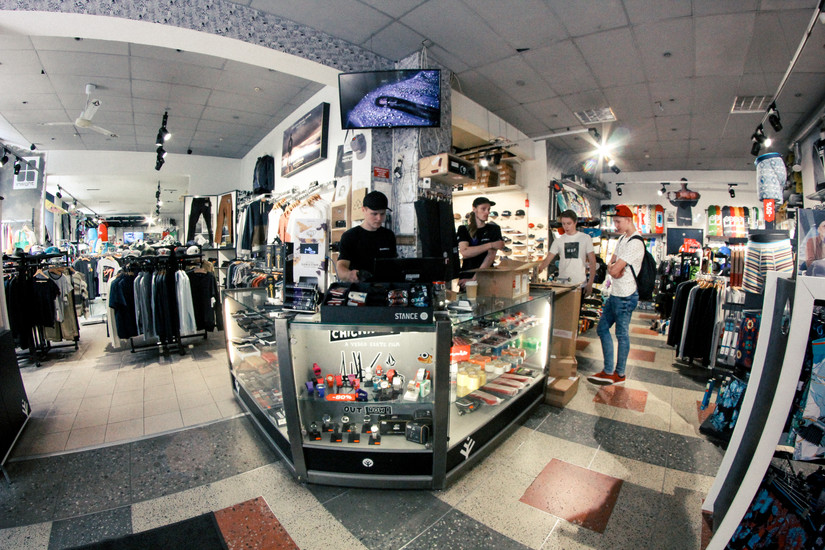
You are a GUI agent. You are given a task and a screenshot of the screen. Output one action in this format:
    pyautogui.click(x=<x>, y=<y>)
    Task: Click on the white ceiling fan
    Image resolution: width=825 pixels, height=550 pixels.
    Given the screenshot: What is the action you would take?
    pyautogui.click(x=81, y=123)